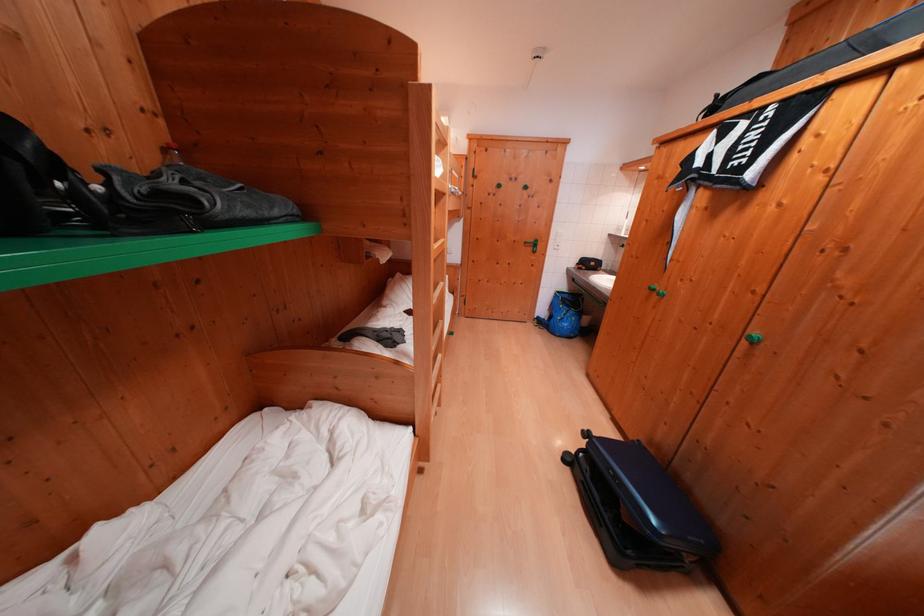
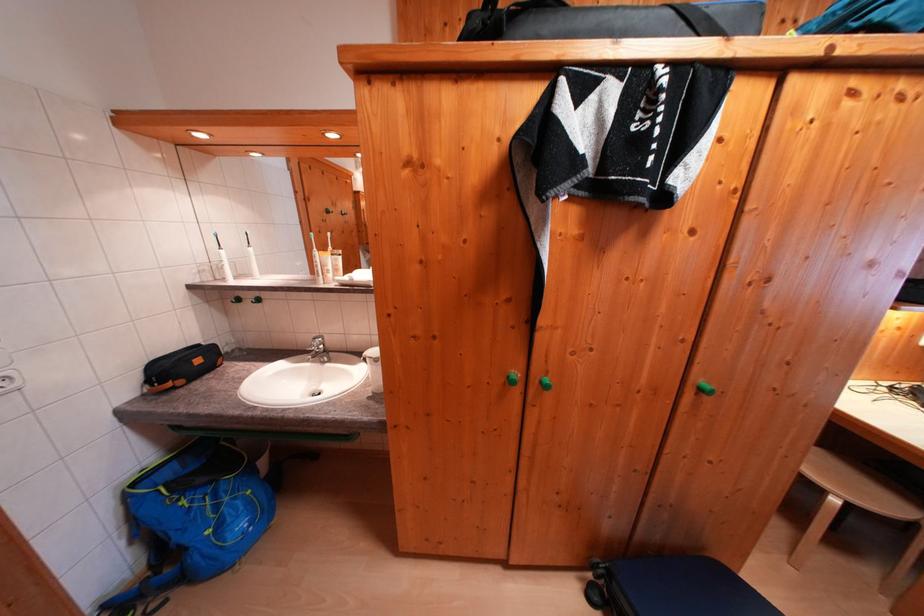
The point at (565,296) is marked in the first image. Where is the corresponding point in the second image?

(142, 488)